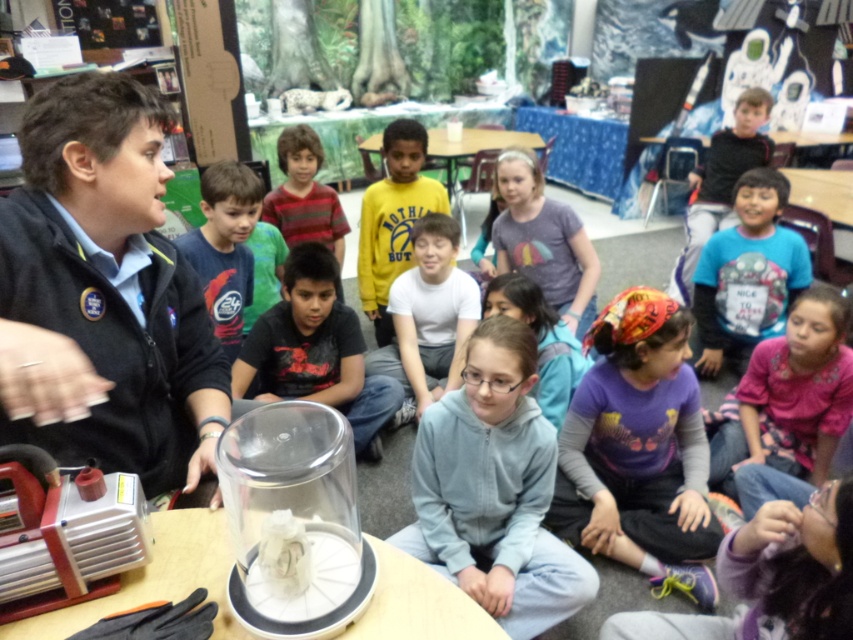
Question: Which of these objects is positioned farthest from the yellow cotton shirt at center?

Choices:
 (A) pink floral shirt at lower right
 (B) dark blue jersey at center

Answer: (A)

Question: Does purple fabric headband at center appear on the right side of purple cotton shirt at center?

Choices:
 (A) no
 (B) yes

Answer: (B)

Question: Is the position of transparent plastic table at center more distant than that of white matte shirt at center?

Choices:
 (A) yes
 (B) no

Answer: (B)

Question: Which point is closer to the camera?

Choices:
 (A) (727, 424)
 (B) (733, 180)
 (C) (624, 561)

Answer: (C)

Question: Where is transparent plastic table at center located in relation to purple cotton shirt at center in the image?

Choices:
 (A) below
 (B) above

Answer: (A)

Question: Which point appears farthest from the camera in this image?

Choices:
 (A) (469, 285)
 (B) (572, 324)
 (C) (744, 138)

Answer: (C)